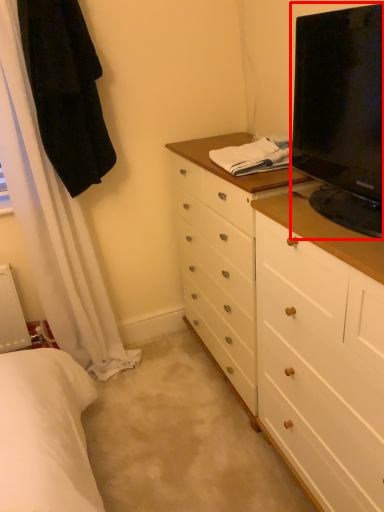
Question: From the image, what is the correct spatial relationship of television (annotated by the red box) in relation to robe?

Choices:
 (A) right
 (B) left

Answer: (A)